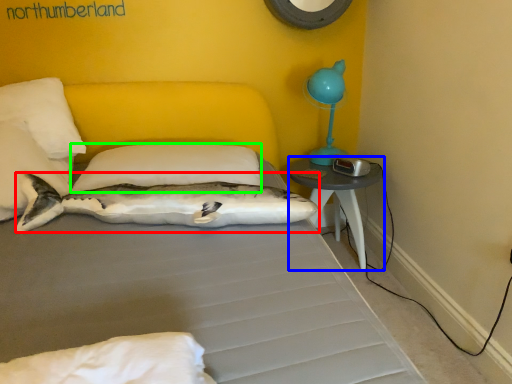
Question: Which is farther away from shark (highlighted by a red box)? nightstand (highlighted by a blue box) or pillow (highlighted by a green box)?

Choices:
 (A) nightstand
 (B) pillow

Answer: (A)